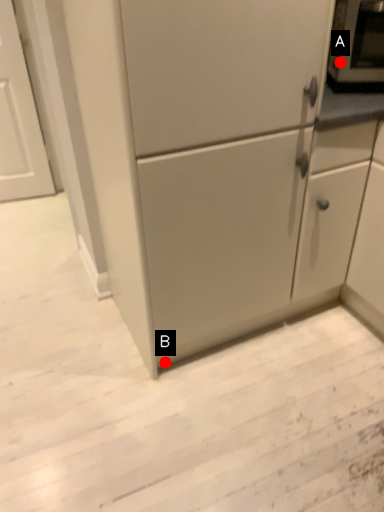
Question: Two points are circled on the image, labeled by A and B beside each circle. Which point appears farthest from the camera in this image?

Choices:
 (A) A is further
 (B) B is further

Answer: (B)